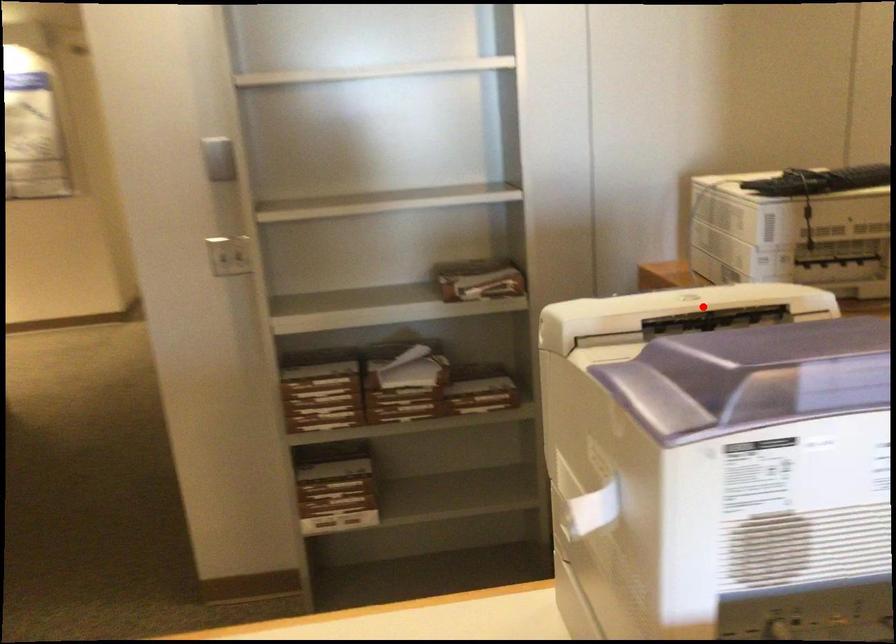
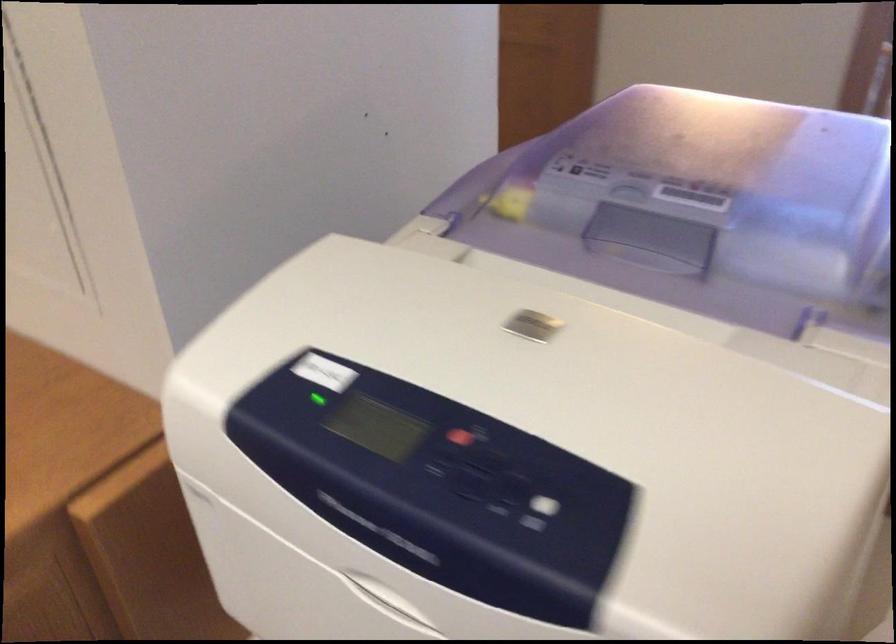
In the second image, find the point that corresponds to the highlighted location in the first image.

(539, 325)